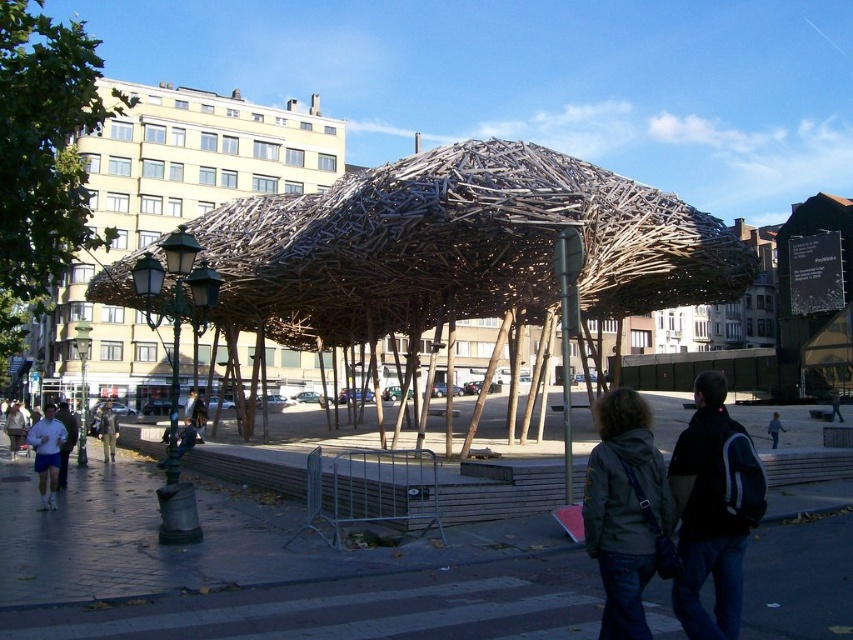
Who is positioned more to the left, white cotton shirt at lower left or light blue jeans at lower right?

Positioned to the left is white cotton shirt at lower left.

Find the location of a particular element. white cotton shirt at lower left is located at coordinates (15, 428).

Which of these two, khaki fabric jacket at lower left or light blue jeans at lower right, stands shorter?

→ With less height is light blue jeans at lower right.

This screenshot has width=853, height=640. In order to click on khaki fabric jacket at lower left in this screenshot , I will do `click(107, 432)`.

Between black backpack at lower right and light blue jeans at lower right, which one has less height?

light blue jeans at lower right

Between point (685, 524) and point (769, 422), which one is positioned behind?

Point (769, 422)

You are a GUI agent. You are given a task and a screenshot of the screen. Output one action in this format:
    pyautogui.click(x=<x>, y=<y>)
    Task: Click on the black backpack at lower right
    Image resolution: width=853 pixels, height=640 pixels.
    Given the screenshot: What is the action you would take?
    pyautogui.click(x=712, y=512)